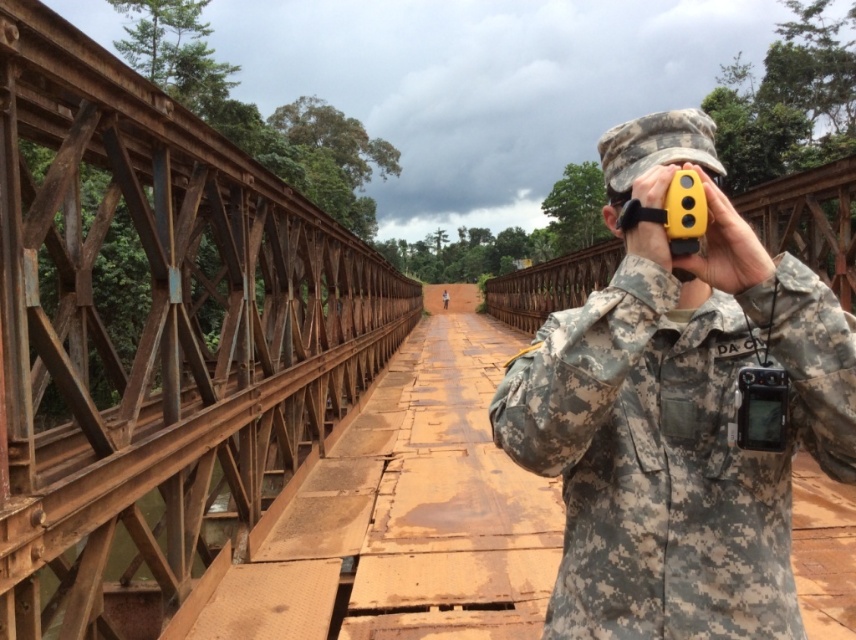
You are a surveyor standing on the rusty metal bridge at left. You notice the camouflage fabric binoculars at center. Which object is wider?

The rusty metal bridge at left is wider than the camouflage fabric binoculars at center.

You are standing on a wooden walkway of a bridge and want to take a photo of the rusty metal bridge at left. Where should you position yourself to capture the entire bridge in your camera frame?

The rusty metal bridge at left is located at point 2D coordinates (153, 337). To capture the entire bridge in your camera frame, position yourself centrally along the walkway so that the bridge is framed within the camera viewfinder at those coordinates.

You are a surveyor standing on the rusty metal bridge at left and looking towards the camouflage fabric binoculars at center. Which object is closer to you?

The camouflage fabric binoculars at center are closer to you since the rusty metal bridge at left is further away.